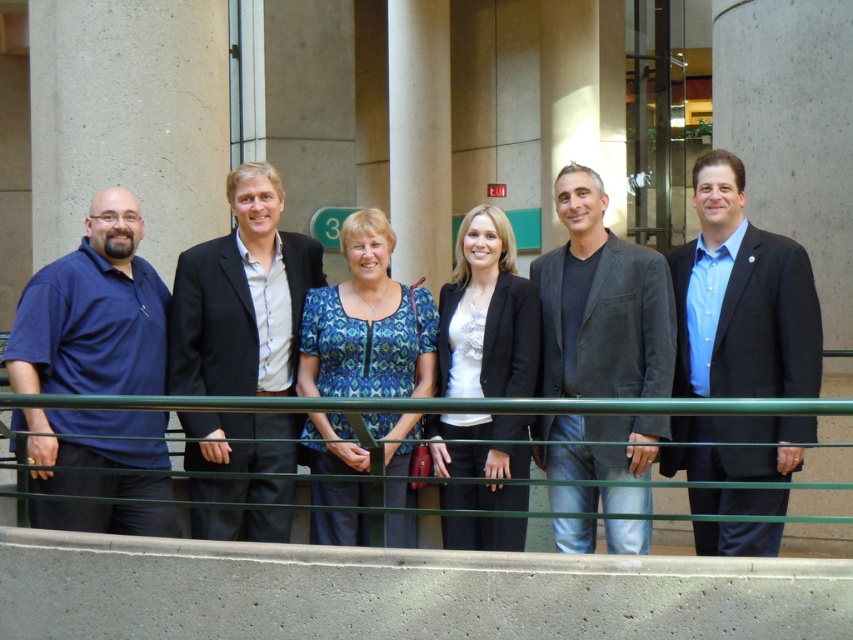
Question: In this image, where is dark gray blazer at center located relative to white matte blazer at center?

Choices:
 (A) right
 (B) left

Answer: (A)

Question: Which point is closer to the camera?

Choices:
 (A) white matte blazer at center
 (B) black matte suit at center
 (C) white marble pillar at center

Answer: (B)

Question: Which of these objects is positioned closest to the blue patterned blouse at center?

Choices:
 (A) dark gray blazer at center
 (B) white marble pillar at center
 (C) blue shirt at center
 (D) green glass rail at center

Answer: (A)

Question: Is black matte suit at center thinner than green glass rail at center?

Choices:
 (A) yes
 (B) no

Answer: (B)

Question: Among these points, which one is farthest from the camera?

Choices:
 (A) (277, 401)
 (B) (444, 296)
 (C) (328, 515)
 (D) (100, 257)

Answer: (B)

Question: Can you confirm if matte blue polo shirt at left is positioned above white matte blazer at center?

Choices:
 (A) no
 (B) yes

Answer: (B)